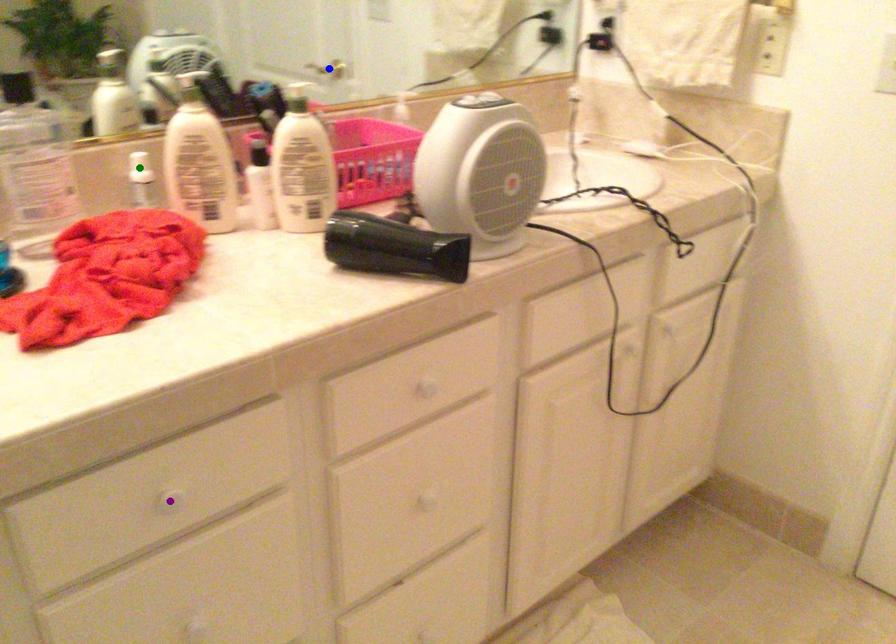
Looking at this image, order these from nearest to farthest:
purple point
green point
blue point

blue point, green point, purple point